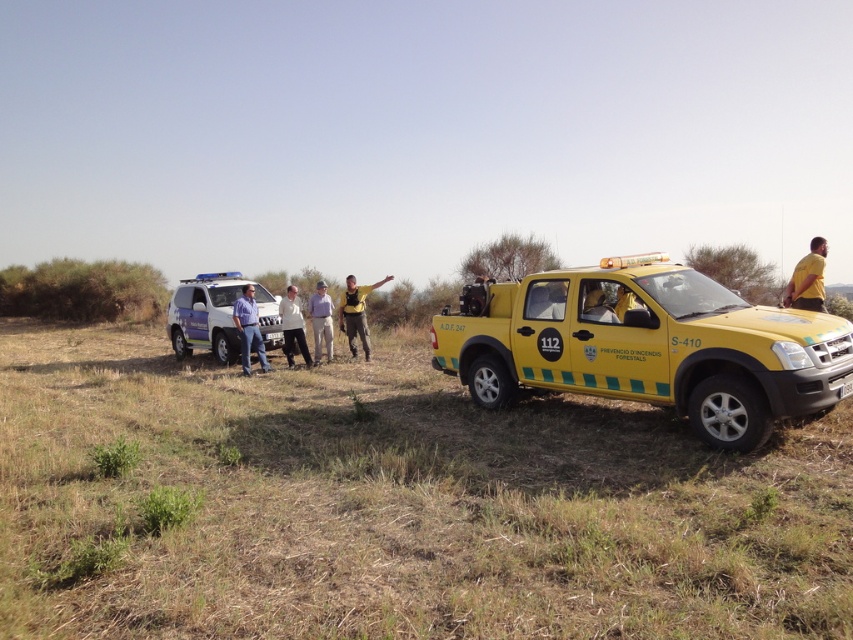
Does yellow fabric shirt at center have a greater height compared to blue shirt at center?

No.

Who is taller, yellow fabric shirt at center or blue shirt at center?

Standing taller between the two is blue shirt at center.

Based on the photo, who is more forward, [346,320] or [259,356]?

Point [259,356]

Identify the location of yellow fabric shirt at center. (357, 312).

Is yellow matte shirt at upper right thinner than blue shirt at center?

In fact, yellow matte shirt at upper right might be wider than blue shirt at center.

Does yellow matte shirt at upper right have a lesser height compared to blue shirt at center?

No.

Does point (821, 269) come in front of point (247, 317)?

That is True.

Where is `yellow matte shirt at upper right`? Image resolution: width=853 pixels, height=640 pixels. yellow matte shirt at upper right is located at coordinates (808, 280).

Between yellow fabric shirt at center and light brown leather jacket at center, which one appears on the right side from the viewer's perspective?

From the viewer's perspective, yellow fabric shirt at center appears more on the right side.

Looking at this image, who is more distant from viewer, (x=352, y=284) or (x=317, y=330)?

The point (x=352, y=284) is behind.

Which is behind, point (354, 321) or point (315, 326)?

Positioned behind is point (315, 326).

Find the location of a particular element. yellow fabric shirt at center is located at coordinates (357, 312).